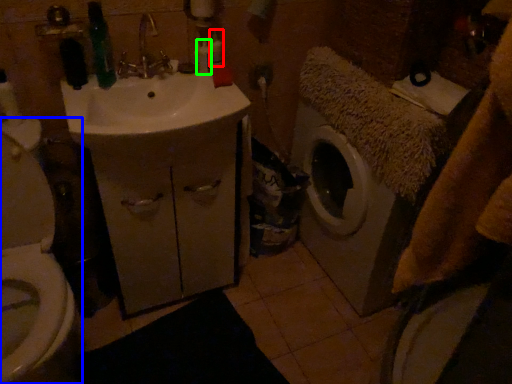
Question: Which object is the farthest from toiletry (highlighted by a red box)? Choose among these: toilet (highlighted by a blue box) or toiletry (highlighted by a green box).

Choices:
 (A) toilet
 (B) toiletry

Answer: (A)